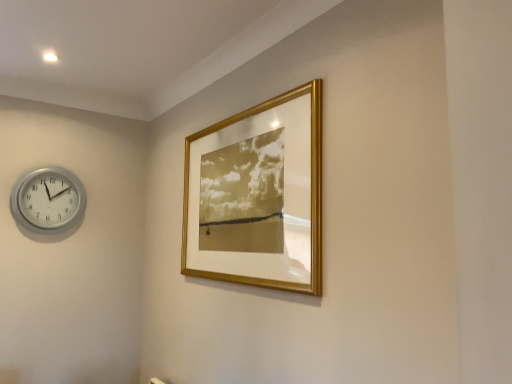
Question: From the image's perspective, relative to silver metallic wall clock at left, is gold metallic picture frame at upper center above or below?

Choices:
 (A) below
 (B) above

Answer: (B)

Question: Is gold metallic picture frame at upper center inside the boundaries of silver metallic wall clock at left, or outside?

Choices:
 (A) outside
 (B) inside

Answer: (A)

Question: Based on their sizes in the image, would you say gold metallic picture frame at upper center is bigger or smaller than silver metallic wall clock at left?

Choices:
 (A) big
 (B) small

Answer: (A)

Question: Visually, is silver metallic wall clock at left positioned to the left or to the right of gold metallic picture frame at upper center?

Choices:
 (A) left
 (B) right

Answer: (A)

Question: Is silver metallic wall clock at left taller or shorter than gold metallic picture frame at upper center?

Choices:
 (A) short
 (B) tall

Answer: (A)

Question: Is silver metallic wall clock at left inside the boundaries of gold metallic picture frame at upper center, or outside?

Choices:
 (A) outside
 (B) inside

Answer: (A)

Question: Looking at their shapes, would you say silver metallic wall clock at left is wider or thinner than gold metallic picture frame at upper center?

Choices:
 (A) wide
 (B) thin

Answer: (A)